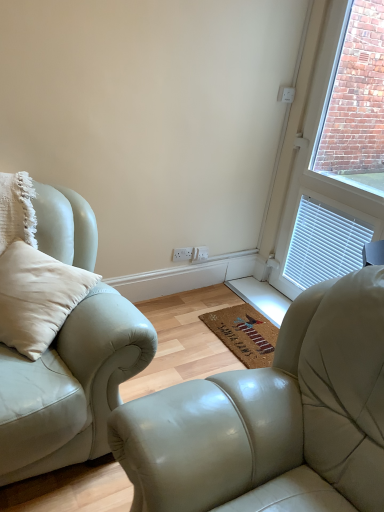
Measure the distance between point (317,71) and camera.

The depth of point (317,71) is 2.38 meters.

The image size is (384, 512). What do you see at coordinates (337, 154) in the screenshot? I see `white textured window at upper right` at bounding box center [337, 154].

Where is `coir mat at center`? The image size is (384, 512). coir mat at center is located at coordinates (244, 334).

Would you say white plastic electric outlet at center is part of light beige leather couch at left's contents?

No.

Can you confirm if light beige leather couch at left is bigger than white plastic electric outlet at center?

Yes, light beige leather couch at left is bigger than white plastic electric outlet at center.

How many degrees apart are the facing directions of light beige leather couch at left and white plastic electric outlet at center?

58.4 degrees.

From a real-world perspective, which object rests below the other?

white plastic electric outlet at center is physically lower.

Considering the relative sizes of light beige leather couch at left and white textured window at upper right in the image provided, is light beige leather couch at left taller than white textured window at upper right?

In fact, light beige leather couch at left may be shorter than white textured window at upper right.

Which is behind, light beige leather couch at left or white textured window at upper right?

white textured window at upper right is more distant.

Identify the location of studio couch that is under the white textured window at upper right (from a real-world perspective). The width and height of the screenshot is (384, 512). (70, 386).

Consider the image. How much distance is there between light beige leather couch at left and white textured window at upper right?

light beige leather couch at left is 5.04 feet away from white textured window at upper right.

Can you tell me how much white textured window at upper right and coir mat at center differ in facing direction?

0.000612 degrees separate the facing orientations of white textured window at upper right and coir mat at center.

From the picture: Which of these two, white textured window at upper right or coir mat at center, is thinner?

white textured window at upper right is thinner.

Is white textured window at upper right inside or outside of coir mat at center?

white textured window at upper right is not inside coir mat at center, it's outside.

Does white textured window at upper right have a greater height compared to light beige leather couch at left?

Yes.

Is white textured window at upper right in front of or behind light beige leather couch at left in the image?

Visually, white textured window at upper right is located behind light beige leather couch at left.

The height and width of the screenshot is (512, 384). I want to click on window on the right of light beige leather couch at left, so 337,154.

Which is farther from the camera, (324, 52) or (80, 198)?

The point (324, 52) is more distant.

Is coir mat at center looking in the opposite direction of white textured window at upper right?

No, coir mat at center's orientation is not away from white textured window at upper right.

Is point (273, 327) more distant than point (335, 225)?

No, (273, 327) is closer to viewer.

Is coir mat at center at the right side of white textured window at upper right?

No.

Considering the sizes of objects light beige leather couch at left and coir mat at center in the image provided, who is shorter, light beige leather couch at left or coir mat at center?

Standing shorter between the two is coir mat at center.

Does light beige leather couch at left have a smaller size compared to coir mat at center?

Incorrect, light beige leather couch at left is not smaller in size than coir mat at center.

How many degrees apart are the facing directions of light beige leather couch at left and coir mat at center?

31.6 degrees.

Is light beige leather couch at left to the left or to the right of coir mat at center in the image?

light beige leather couch at left is positioned on coir mat at center's left side.

Is coir mat at center positioned with its back to white plastic electric outlet at center?

No, coir mat at center is not facing the opposite direction of white plastic electric outlet at center.

Between coir mat at center and white plastic electric outlet at center, which one has smaller width?

white plastic electric outlet at center is thinner.

In the image, is coir mat at center positioned in front of or behind white plastic electric outlet at center?

In the image, coir mat at center appears in front of white plastic electric outlet at center.

Who is bigger, coir mat at center or white plastic electric outlet at center?

Bigger between the two is coir mat at center.

The width and height of the screenshot is (384, 512). I want to click on electric outlet below the light beige leather couch at left (from a real-world perspective), so click(182, 254).

You are a GUI agent. You are given a task and a screenshot of the screen. Output one action in this format:
    pyautogui.click(x=<x>, y=<y>)
    Task: Click on the window on the right of light beige leather couch at left
    
    Given the screenshot: What is the action you would take?
    pyautogui.click(x=337, y=154)

Considering their positions, is white plastic electric outlet at center positioned further to coir mat at center than light beige leather couch at left?

light beige leather couch at left.

Looking at the image, which one is located further to light beige leather couch at left, white textured window at upper right or white plastic electric outlet at center?

white textured window at upper right.

Considering their positions, is coir mat at center positioned closer to white plastic electric outlet at center than light beige leather couch at left?

coir mat at center is closer to white plastic electric outlet at center.

In the scene shown: Estimate the real-world distances between objects in this image. Which object is further from coir mat at center, white textured window at upper right or light beige leather couch at left?

Based on the image, light beige leather couch at left appears to be further to coir mat at center.

When comparing their distances from white textured window at upper right, does light beige leather couch at left or white plastic electric outlet at center seem further?

Based on the image, light beige leather couch at left appears to be further to white textured window at upper right.

Based on their spatial positions, is white textured window at upper right or light beige leather couch at left further from white plastic electric outlet at center?

light beige leather couch at left lies further to white plastic electric outlet at center than the other object.

Considering their positions, is light beige leather couch at left positioned closer to coir mat at center than white plastic electric outlet at center?

white plastic electric outlet at center is positioned closer to the anchor coir mat at center.

Considering their positions, is white plastic electric outlet at center positioned further to light beige leather couch at left than coir mat at center?

white plastic electric outlet at center lies further to light beige leather couch at left than the other object.

Image resolution: width=384 pixels, height=512 pixels. I want to click on electric outlet between light beige leather couch at left and white textured window at upper right from left to right, so click(182, 254).

The image size is (384, 512). Identify the location of doormat between light beige leather couch at left and white textured window at upper right in the horizontal direction. (244, 334).

Find the location of a particular element. doormat located between white textured window at upper right and white plastic electric outlet at center in the depth direction is located at coordinates (244, 334).

At what (x,y) coordinates should I click in order to perform the action: click on doormat between light beige leather couch at left and white plastic electric outlet at center along the z-axis. Please return your answer as a coordinate pair (x, y). This screenshot has height=512, width=384. Looking at the image, I should click on (244, 334).